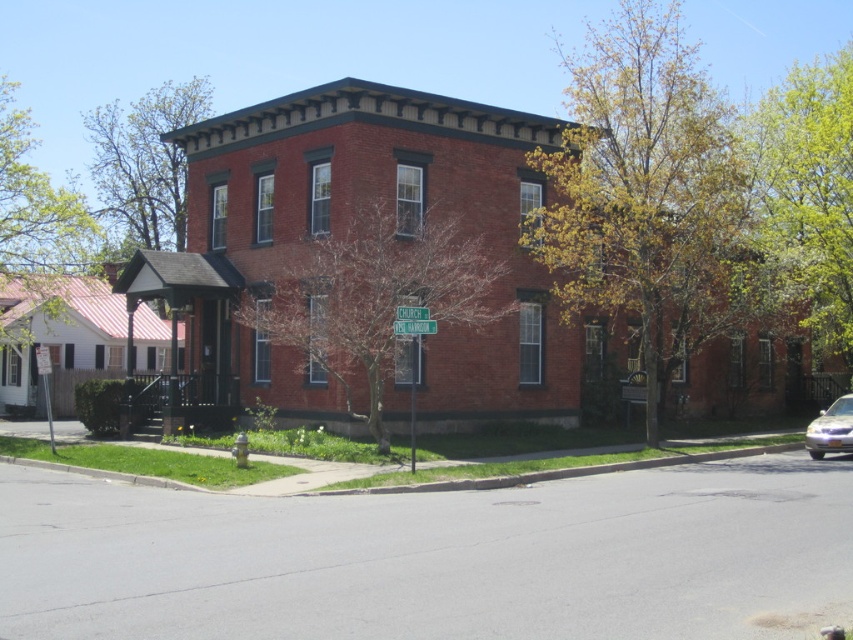
You are a delivery driver approaching the building on Church Street. You need to park your vehicle, the satin blue sedan at lower right, but there is a green leafy tree at upper right in the way. Can you safely maneuver around the tree to park?

The green leafy tree at upper right is located above the satin blue sedan at lower right, which means the tree is not blocking the path to park the sedan. Therefore, you can safely maneuver around the tree to park.